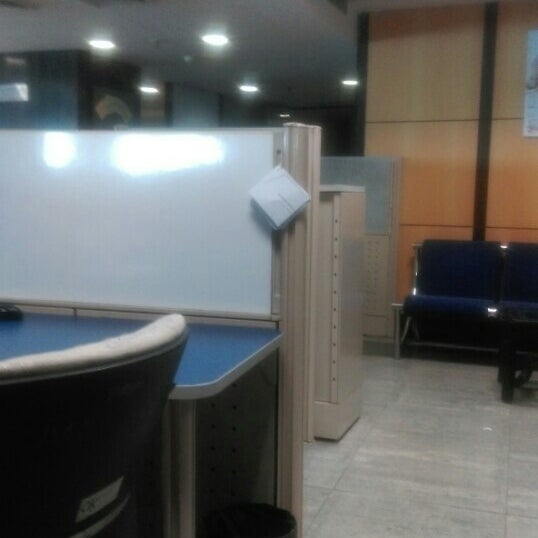
At what (x,y) coordinates should I click in order to perform the action: click on wall poster. Please return your answer as a coordinate pair (x, y). The image size is (538, 538). Looking at the image, I should click on (530, 122).